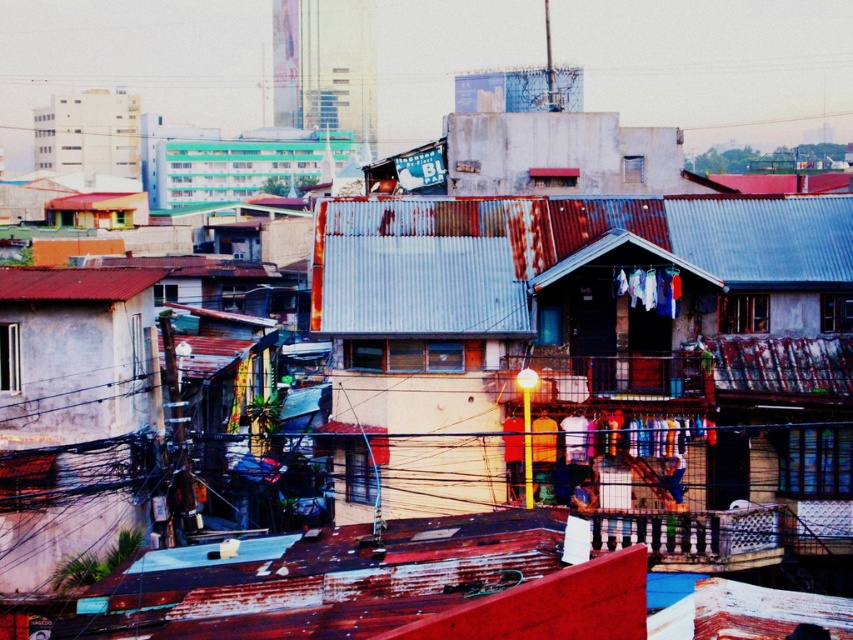
Question: Which point is farther to the camera?

Choices:
 (A) (154, 70)
 (B) (321, 205)
 (C) (241, 156)

Answer: (A)

Question: Which point is closer to the camera?

Choices:
 (A) (833, 467)
 (B) (631, 68)
 (C) (55, 289)
 (D) (320, 161)

Answer: (A)

Question: Observing the image, what is the correct spatial positioning of teal plastic building at upper center in reference to metallic wire at upper center?

Choices:
 (A) left
 (B) right

Answer: (A)

Question: Can you confirm if rusty corrugated metal roof at center is wider than teal plastic building at upper center?

Choices:
 (A) no
 (B) yes

Answer: (A)

Question: Is rusty corrugated metal roof at center below rusty metal roof at left?

Choices:
 (A) yes
 (B) no

Answer: (B)

Question: Which point appears farthest from the camera in this image?

Choices:
 (A) (148, 195)
 (B) (670, 364)
 (C) (735, 74)
 (D) (109, 280)

Answer: (C)